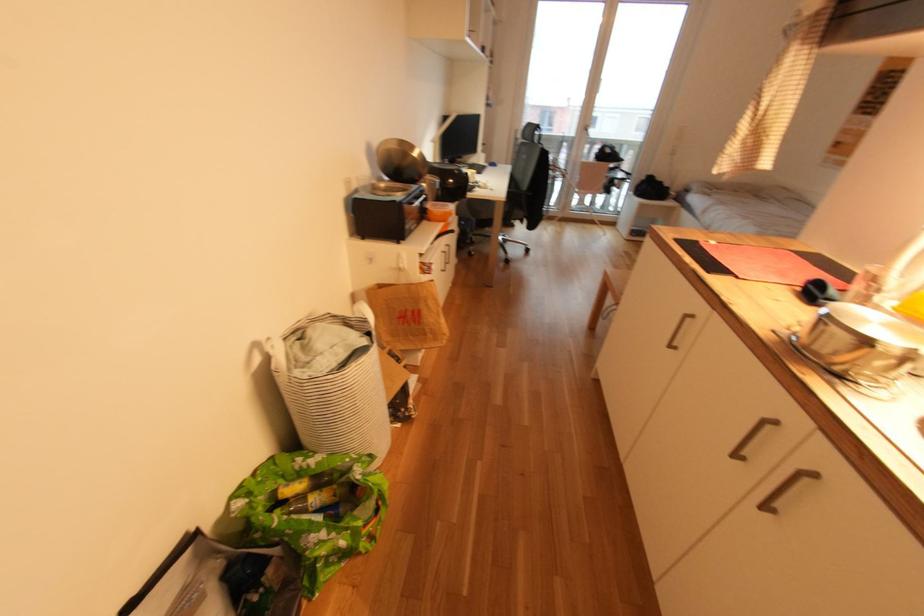
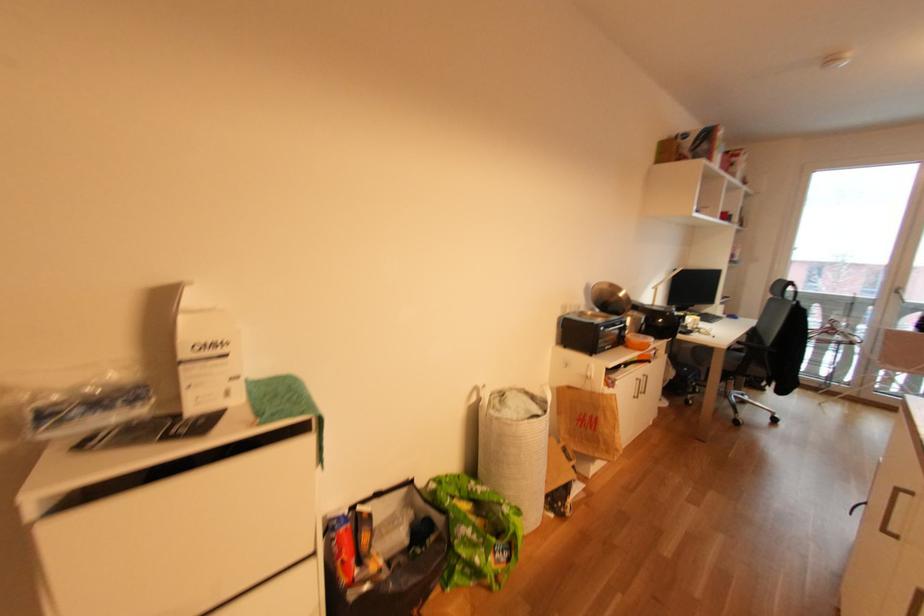
First-person continuous shooting, in which direction is the camera rotating?

The camera rotated toward left-up.